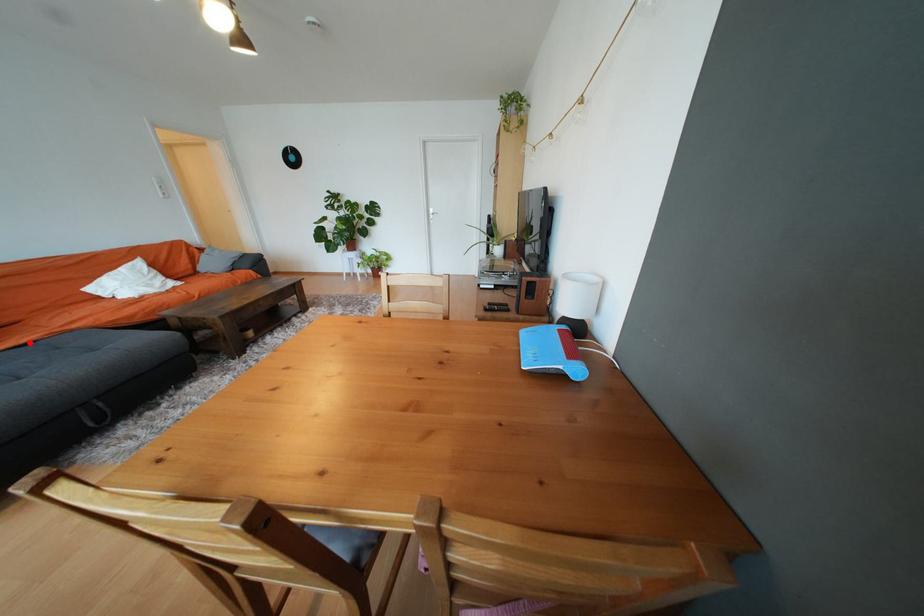
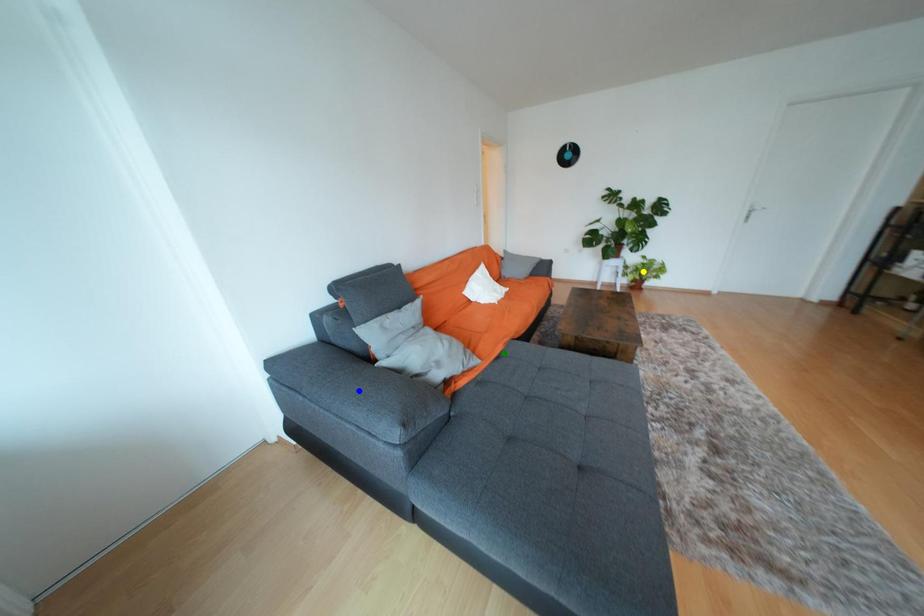
Question: I am providing you with two images of the same scene from different viewpoints. A red point is marked on the first image. You are given multiple points on the second image. Which spot in image 2 lines up with the point in image 1?

Choices:
 (A) blue point
 (B) green point
 (C) yellow point

Answer: (B)